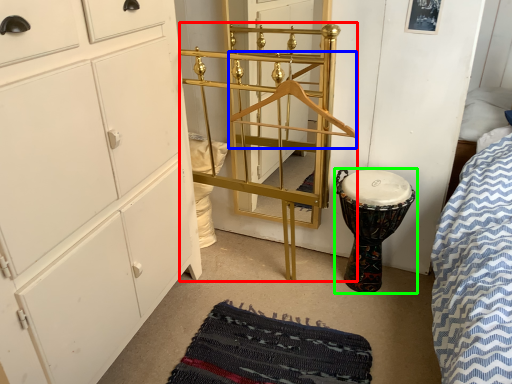
Question: Which object is positioned farthest from bunk bed (highlighted by a red box)? Select from hanger (highlighted by a blue box) and drum (highlighted by a green box).

Choices:
 (A) hanger
 (B) drum

Answer: (B)